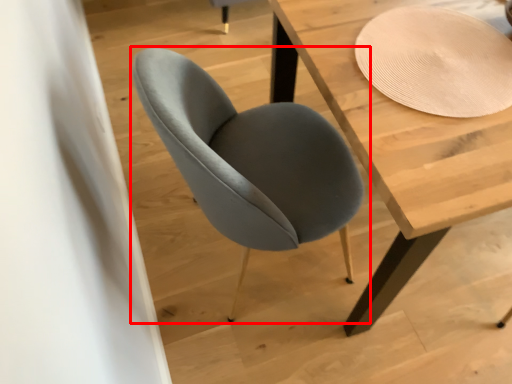
Question: Where is chair (annotated by the red box) located in relation to table in the image?

Choices:
 (A) left
 (B) right

Answer: (A)